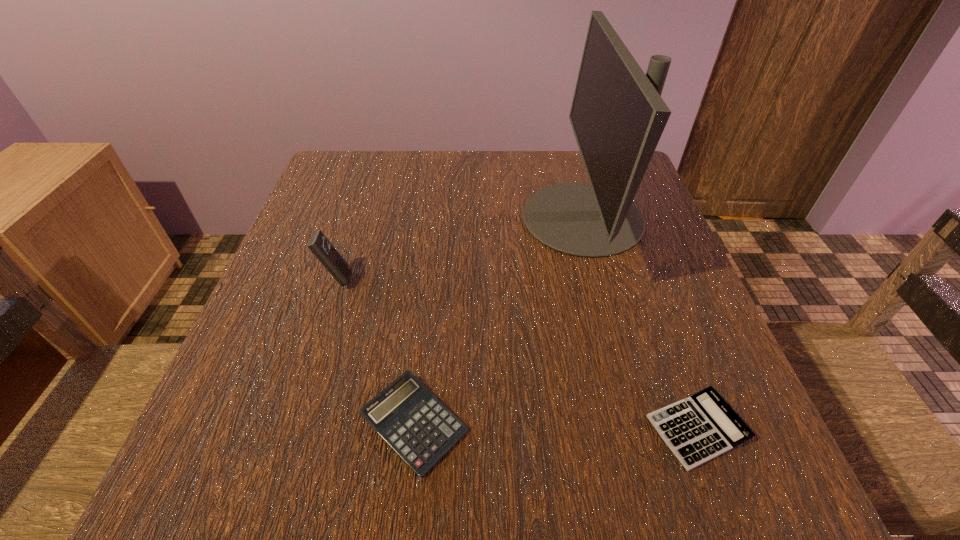
You are a GUI agent. You are given a task and a screenshot of the screen. Output one action in this format:
    pyautogui.click(x=<x>, y=<y>)
    Task: Click on the computer monitor
    Image resolution: width=960 pixels, height=540 pixels.
    Given the screenshot: What is the action you would take?
    pyautogui.click(x=617, y=114)

Where is `the farthest calculator`? This screenshot has width=960, height=540. the farthest calculator is located at coordinates 319,245.

Locate an element on the screen. The width and height of the screenshot is (960, 540). the leftmost object is located at coordinates (319, 245).

Where is `the third object from right to left`? The image size is (960, 540). the third object from right to left is located at coordinates (406, 415).

Find the location of a particular element. The width and height of the screenshot is (960, 540). the second calculator from right to left is located at coordinates (406, 415).

What are the coordinates of `the shortest calculator` in the screenshot? It's located at (697, 429).

Image resolution: width=960 pixels, height=540 pixels. Find the location of `the shortest object`. the shortest object is located at coordinates (697, 429).

At what (x,y) coordinates should I click in order to perform the action: click on vacant area located on the screen of the tallest object. Please return your answer as a coordinate pair (x, y). The width and height of the screenshot is (960, 540). Looking at the image, I should click on (345, 218).

You are a GUI agent. You are given a task and a screenshot of the screen. Output one action in this format:
    pyautogui.click(x=<x>, y=<y>)
    Task: Click on the free region located on the screen of the tallest object
    
    Given the screenshot: What is the action you would take?
    pyautogui.click(x=487, y=218)

Locate an element on the screen. vacant space located on the screen of the tallest object is located at coordinates (438, 218).